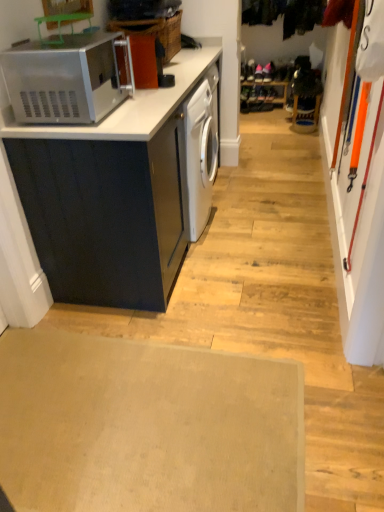
What do you see at coordinates (146, 426) in the screenshot? I see `beige carpet at lower center` at bounding box center [146, 426].

Locate an element on the screen. beige carpet at lower center is located at coordinates (146, 426).

Between matte black cabinet at left and satin silver microwave at upper left, which one appears on the right side from the viewer's perspective?

Positioned to the right is matte black cabinet at left.

Which point is more distant from viewer, (94, 262) or (73, 110)?

The point (94, 262) is farther from the camera.

Locate an element on the screen. This screenshot has width=384, height=512. cabinetry located behind the satin silver microwave at upper left is located at coordinates (110, 196).

Does matte black cabinet at left have a lesser width compared to satin silver microwave at upper left?

In fact, matte black cabinet at left might be wider than satin silver microwave at upper left.

Consider the image. Considering the positions of objects satin silver microwave at upper left and matte black cabinet at left in the image provided, who is behind, satin silver microwave at upper left or matte black cabinet at left?

Positioned behind is matte black cabinet at left.

This screenshot has height=512, width=384. What are the coordinates of `cabinetry that is behind the satin silver microwave at upper left` in the screenshot? It's located at (110, 196).

Which is correct: satin silver microwave at upper left is inside matte black cabinet at left, or outside of it?

satin silver microwave at upper left is not inside matte black cabinet at left, it's outside.

Is satin silver microwave at upper left at the right side of matte black cabinet at left?

In fact, satin silver microwave at upper left is to the left of matte black cabinet at left.

Is beige carpet at lower center taller or shorter than matte black cabinet at left?

beige carpet at lower center is shorter than matte black cabinet at left.

Is beige carpet at lower center positioned with its back to matte black cabinet at left?

No, beige carpet at lower center is not facing the opposite direction of matte black cabinet at left.

Who is bigger, beige carpet at lower center or matte black cabinet at left?

Bigger between the two is matte black cabinet at left.

From the image's perspective, which is below, beige carpet at lower center or satin silver microwave at upper left?

beige carpet at lower center appears lower in the image.

How many degrees apart are the facing directions of beige carpet at lower center and satin silver microwave at upper left?

beige carpet at lower center and satin silver microwave at upper left are facing 1.03 degrees away from each other.

Is beige carpet at lower center behind satin silver microwave at upper left?

No, it is not.

Who is taller, beige carpet at lower center or satin silver microwave at upper left?

satin silver microwave at upper left.

From the image's perspective, is satin silver microwave at upper left above beige carpet at lower center?

Indeed, from the image's perspective, satin silver microwave at upper left is shown above beige carpet at lower center.

Image resolution: width=384 pixels, height=512 pixels. I want to click on home appliance above the beige carpet at lower center (from a real-world perspective), so click(x=68, y=78).

Can you confirm if satin silver microwave at upper left is smaller than beige carpet at lower center?

No, satin silver microwave at upper left is not smaller than beige carpet at lower center.

What's the angular difference between satin silver microwave at upper left and beige carpet at lower center's facing directions?

1.03 degrees.

Between point (36, 169) and point (20, 435), which one is positioned behind?

Point (36, 169)

Consider the image. Considering the relative sizes of matte black cabinet at left and beige carpet at lower center in the image provided, is matte black cabinet at left taller than beige carpet at lower center?

Yes, matte black cabinet at left is taller than beige carpet at lower center.

Between matte black cabinet at left and beige carpet at lower center, which one appears on the left side from the viewer's perspective?

beige carpet at lower center is more to the left.

Is beige carpet at lower center located within matte black cabinet at left?

No, matte black cabinet at left does not contain beige carpet at lower center.

Image resolution: width=384 pixels, height=512 pixels. Identify the location of cabinetry that is under the satin silver microwave at upper left (from a real-world perspective). (110, 196).

Locate an element on the screen. The width and height of the screenshot is (384, 512). cabinetry behind the satin silver microwave at upper left is located at coordinates (110, 196).

Consider the image. Which object lies further to the anchor point satin silver microwave at upper left, matte black cabinet at left or beige carpet at lower center?

beige carpet at lower center lies further to satin silver microwave at upper left than the other object.

Looking at the image, which one is located closer to beige carpet at lower center, matte black cabinet at left or satin silver microwave at upper left?

Among the two, matte black cabinet at left is located nearer to beige carpet at lower center.

Looking at the image, which one is located further to matte black cabinet at left, beige carpet at lower center or satin silver microwave at upper left?

beige carpet at lower center is further to matte black cabinet at left.

Which object lies nearer to the anchor point satin silver microwave at upper left, beige carpet at lower center or matte black cabinet at left?

Based on the image, matte black cabinet at left appears to be nearer to satin silver microwave at upper left.

Which object lies nearer to the anchor point beige carpet at lower center, satin silver microwave at upper left or matte black cabinet at left?

matte black cabinet at left is closer to beige carpet at lower center.

Which object lies nearer to the anchor point matte black cabinet at left, satin silver microwave at upper left or beige carpet at lower center?

satin silver microwave at upper left.

Locate an element on the screen. The height and width of the screenshot is (512, 384). cabinetry between satin silver microwave at upper left and beige carpet at lower center vertically is located at coordinates (110, 196).